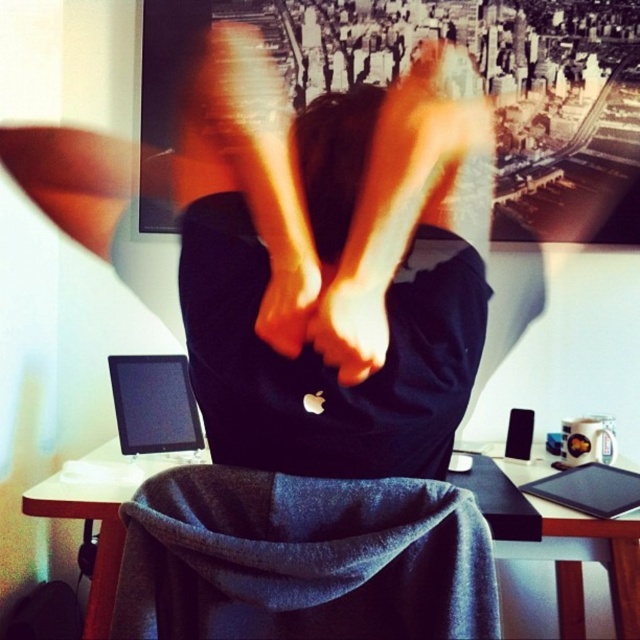
Question: Can you confirm if black matte hoodie at center is positioned to the right of matte black hand at center?

Choices:
 (A) yes
 (B) no

Answer: (B)

Question: Which point is farther from the camera taking this photo?

Choices:
 (A) (33, 506)
 (B) (285, 266)
 (C) (356, 448)

Answer: (A)

Question: Among these points, which one is nearest to the camera?

Choices:
 (A) (109, 522)
 (B) (378, 157)
 (C) (332, 304)
 (D) (307, 298)

Answer: (C)

Question: Does wooden table at center have a larger size compared to matte black hand at center?

Choices:
 (A) no
 (B) yes

Answer: (B)

Question: Which of the following is the closest to the observer?

Choices:
 (A) (376, 301)
 (B) (408, 444)

Answer: (A)

Question: Does wooden table at center come in front of orange matte hand at center?

Choices:
 (A) no
 (B) yes

Answer: (A)